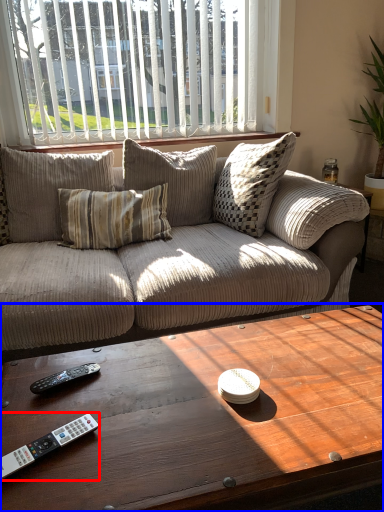
Question: Which object is further to the camera taking this photo, remote control (highlighted by a red box) or coffee table (highlighted by a blue box)?

Choices:
 (A) remote control
 (B) coffee table

Answer: (A)